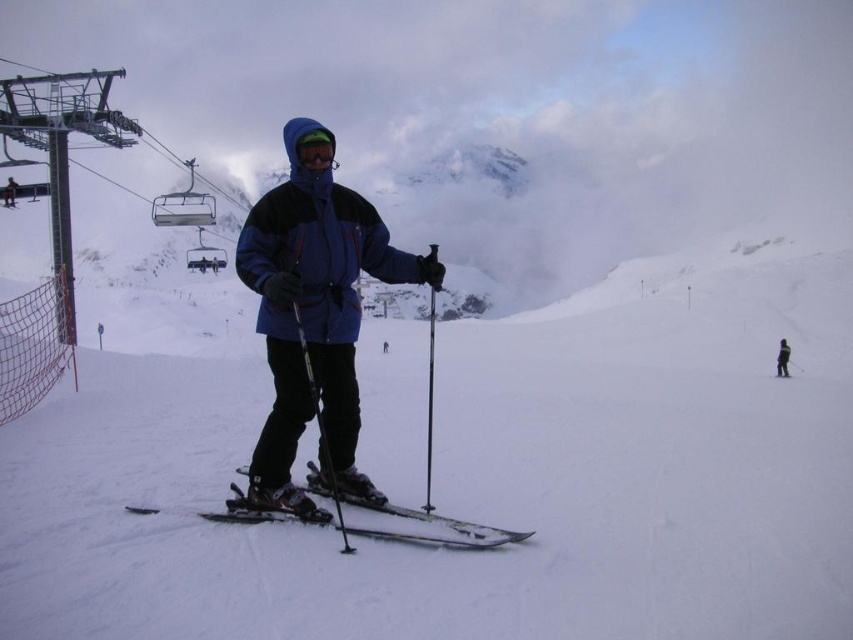
You are a photographer trying to capture the skier in the scene. You notice the black plastic ski pole at center and the dark gray ski pants at center. Which object should you focus on first if you want to ensure both are in sharp focus?

The black plastic ski pole at center is below dark gray ski pants at center, so focusing on the dark gray ski pants at center first will ensure both are in sharp focus since it is closer to the camera.